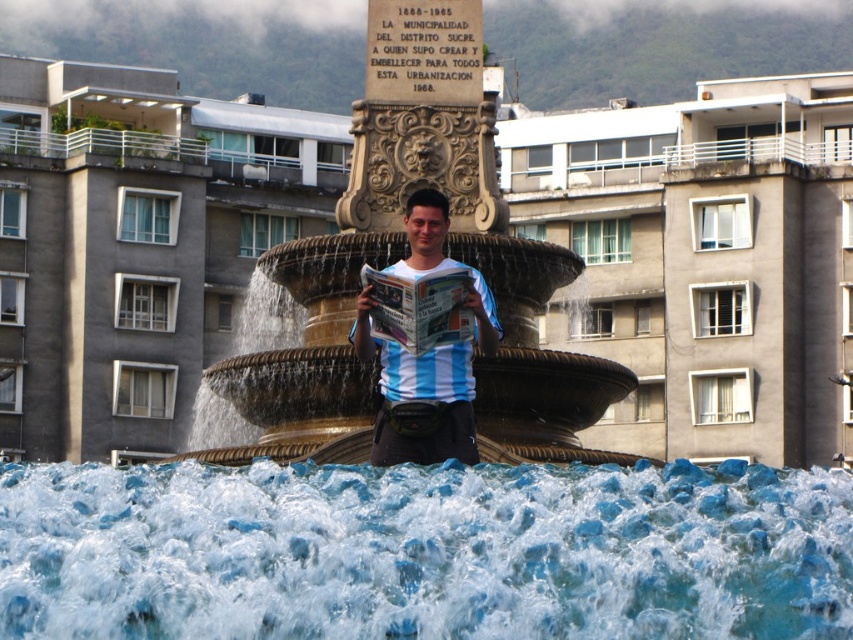
You are standing at the point marked as point (424, 552) in the image. Based on the scene description, what is the surface you are currently standing on?

The surface you are standing on is clear water at fountain center, as the point (424, 552) is located there.

You are a photographer trying to capture the fountain in the background while also including the person in the foreground. Based on the scene, can you position yourself so that the clear water at fountain center is visible behind the blue striped shirt at center?

Yes, because the clear water at fountain center is in front of the blue striped shirt at center, positioning yourself so the person is between you and the fountain would allow the water to appear behind their shirt in the photo.